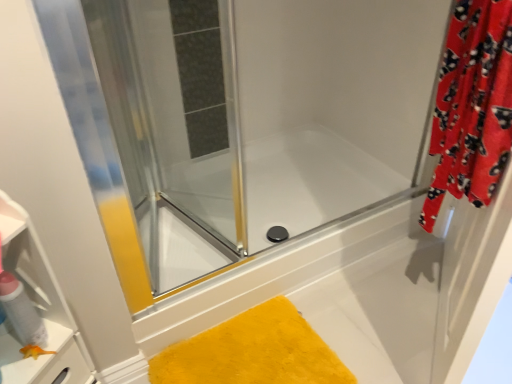
Question: From a real-world perspective, is red fuzzy curtain at right above or below yellow fluffy bath mat at lower center?

Choices:
 (A) above
 (B) below

Answer: (A)

Question: Would you say red fuzzy curtain at right is to the left or to the right of yellow fluffy bath mat at lower center in the picture?

Choices:
 (A) left
 (B) right

Answer: (B)

Question: Estimate the real-world distances between objects in this image. Which object is closer to the matte white spray can at left?

Choices:
 (A) transparent glass shower door at upper left
 (B) yellow fluffy bath mat at lower center
 (C) red fuzzy curtain at right

Answer: (B)

Question: Considering the real-world distances, which object is farthest from the transparent glass shower door at upper left?

Choices:
 (A) matte white spray can at left
 (B) yellow fluffy bath mat at lower center
 (C) red fuzzy curtain at right

Answer: (A)